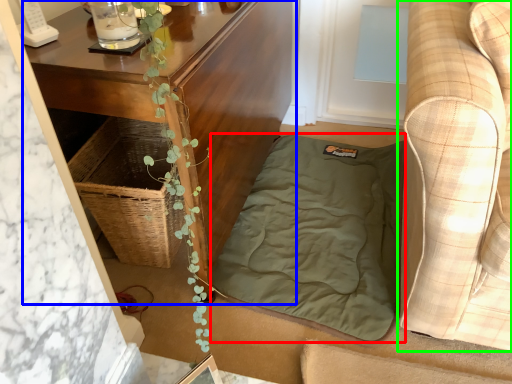
Question: Which is nearer to the blanket (highlighted by a red box)? table (highlighted by a blue box) or studio couch (highlighted by a green box).

Choices:
 (A) table
 (B) studio couch

Answer: (A)